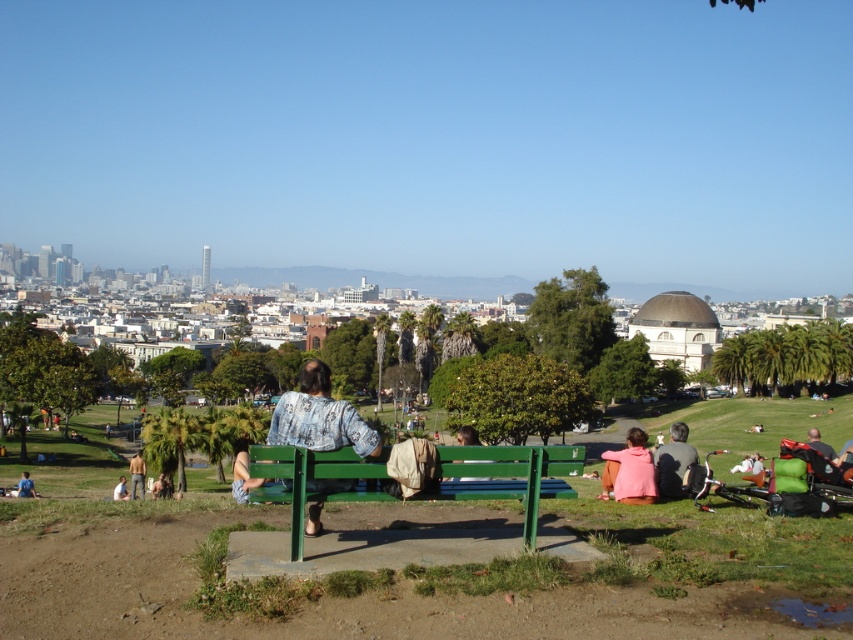
You are standing at the park bench and want to borrow a jacket from either the green fabric jacket at lower right or the denim jacket at lower left. Which jacket is closer to you?

The green fabric jacket at lower right is closer to you because it is in front of the denim jacket at lower left.

You are standing in the park and see the pink fleece jacket at lower right and the white fabric at lower left. Which one is positioned to the right side?

The pink fleece jacket at lower right is positioned to the right of the white fabric at lower left.

You are standing in the park and see two denim jackets. One is the denim jacket at center and the other is the denim jacket at lower left. Which one is positioned to the right side of the other?

The denim jacket at center is to the right of the denim jacket at lower left.